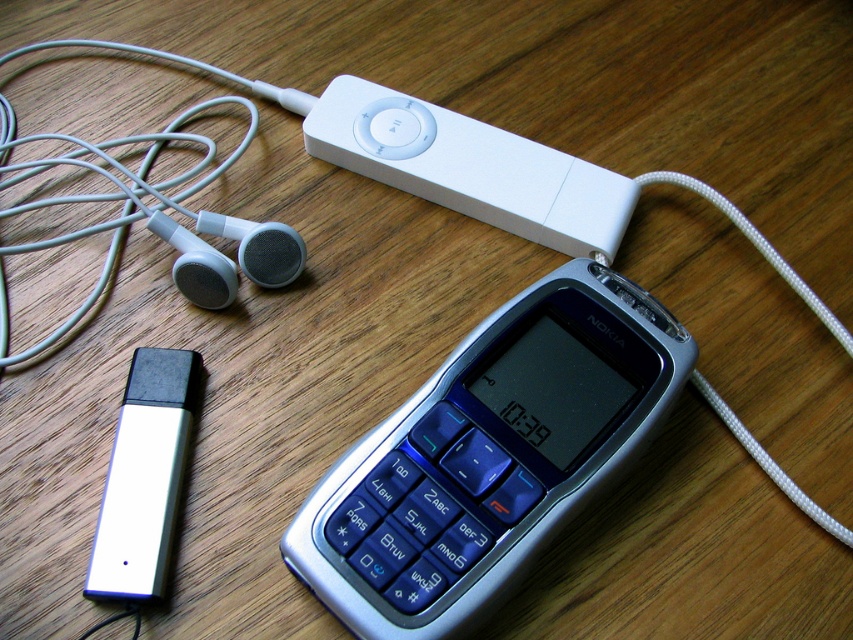
Question: Does silver metallic nokia phone at center appear on the right side of white matte ipod at upper left?

Choices:
 (A) no
 (B) yes

Answer: (B)

Question: Which object appears closest to the camera in this image?

Choices:
 (A) silver metallic nokia phone at center
 (B) satin black earphone at upper left
 (C) white matte earphone at upper left
 (D) white matte ipod at upper center

Answer: (A)

Question: Does white matte ipod at upper left come behind white matte earphone at upper left?

Choices:
 (A) yes
 (B) no

Answer: (B)

Question: Among these objects, which one is nearest to the camera?

Choices:
 (A) white matte ipod at upper left
 (B) satin black earphone at upper left
 (C) white matte earphone at upper left
 (D) silver metallic nokia phone at center

Answer: (D)

Question: Estimate the real-world distances between objects in this image. Which object is closer to the white matte ipod at upper center?

Choices:
 (A) satin black earphone at upper left
 (B) silver metallic nokia phone at center
 (C) white matte earphone at upper left
 (D) white matte ipod at upper left

Answer: (A)

Question: Is white matte ipod at upper left to the right of satin black earphone at upper left from the viewer's perspective?

Choices:
 (A) no
 (B) yes

Answer: (A)